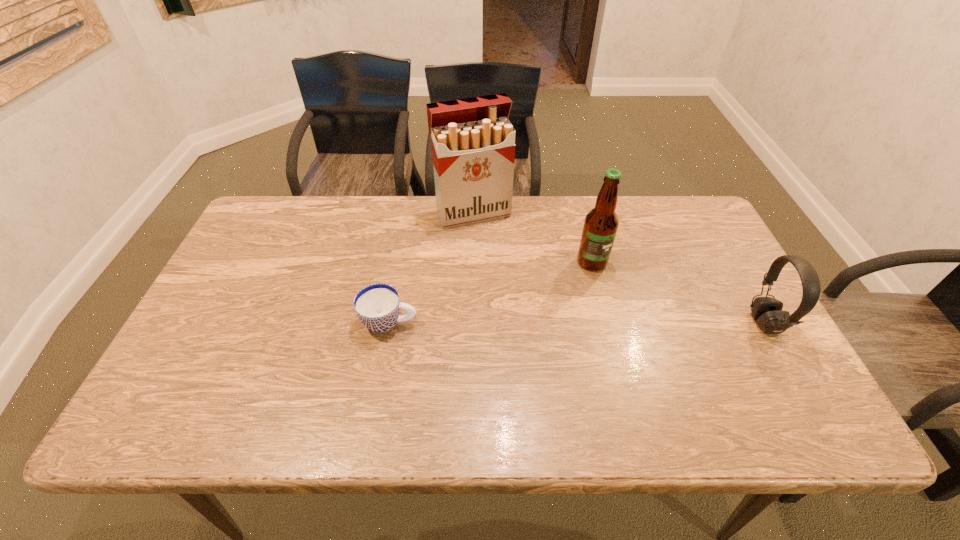
At what (x,y) coordinates should I click in order to perform the action: click on vacant space on the desktop that is between the cup and the headset and is positioned on the label of the second object from right to left. Please return your answer as a coordinate pair (x, y). Looking at the image, I should click on (632, 323).

The image size is (960, 540). Find the location of `vacant spot on the desktop that is between the leftmost object and the headset and is positioned with the lid open on the tallest object`. vacant spot on the desktop that is between the leftmost object and the headset and is positioned with the lid open on the tallest object is located at coordinates (528, 323).